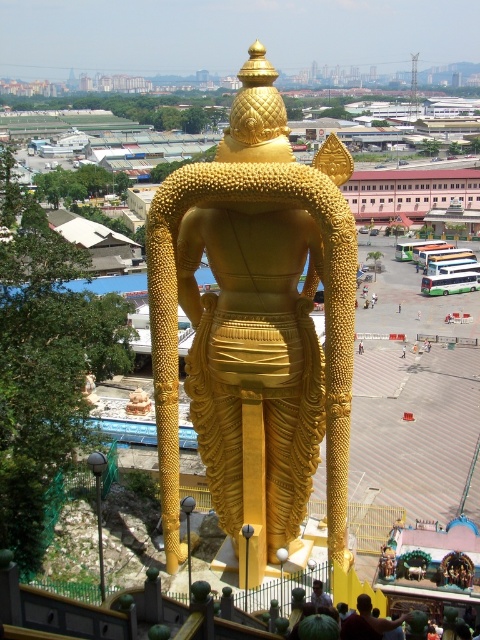
You are a tourist visiting the statue and want to take a photo of the dark brown skin at lower center and the light brown wooden chair at center. Which object should you focus on first if you want to capture both in a single frame without moving the camera?

You should focus on the dark brown skin at lower center first because it is positioned under the light brown wooden chair at center, so keeping the chair in the frame will naturally include the skin as well.

You are a photographer trying to capture a clear shot of the dark brown skin at lower center and the light brown wooden chair at center. From your current position, which object is more to the right?

The dark brown skin at lower center is positioned on the right side of the light brown wooden chair at center, so the dark brown skin at lower center is more to the right.